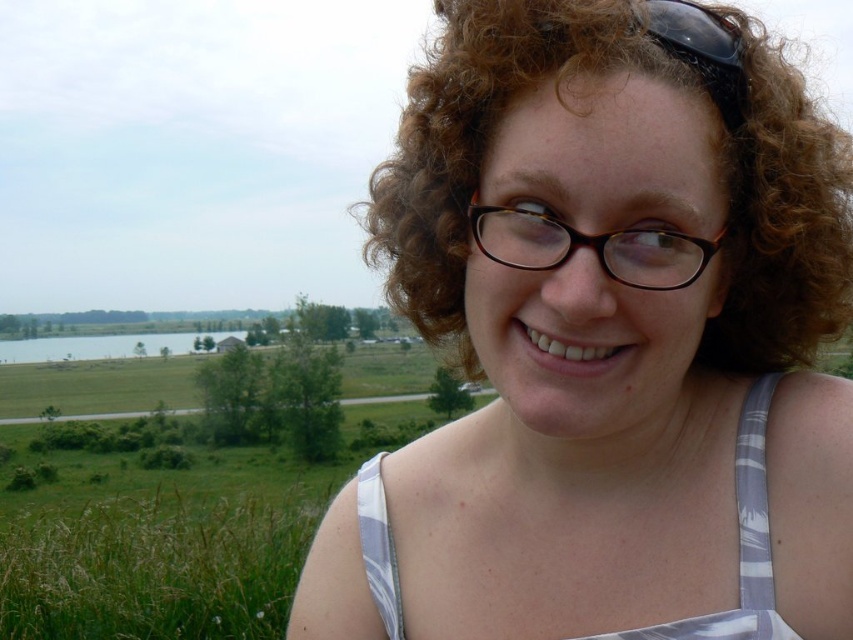
Which is more to the right, matte white tank top at center or black plastic glasses at center?

From the viewer's perspective, black plastic glasses at center appears more on the right side.

Which of these two, matte white tank top at center or black plastic glasses at center, stands taller?

Standing taller between the two is matte white tank top at center.

Identify the location of matte white tank top at center. (608, 340).

This screenshot has width=853, height=640. Find the location of `white striped fabric dress at center`. white striped fabric dress at center is located at coordinates (740, 544).

Is white striped fabric dress at center smaller than black plastic glasses at center?

No, white striped fabric dress at center is not smaller than black plastic glasses at center.

Is point (398, 598) positioned after point (705, 243)?

That is True.

What are the coordinates of `white striped fabric dress at center` in the screenshot? It's located at (740, 544).

Locate an element on the screen. The image size is (853, 640). matte white tank top at center is located at coordinates (608, 340).

Between point (579, 388) and point (376, 476), which one is positioned in front?

Point (579, 388)

Is point (289, 614) more distant than point (764, 552)?

Yes, point (289, 614) is behind point (764, 552).

Where is `matte white tank top at center`? matte white tank top at center is located at coordinates (608, 340).